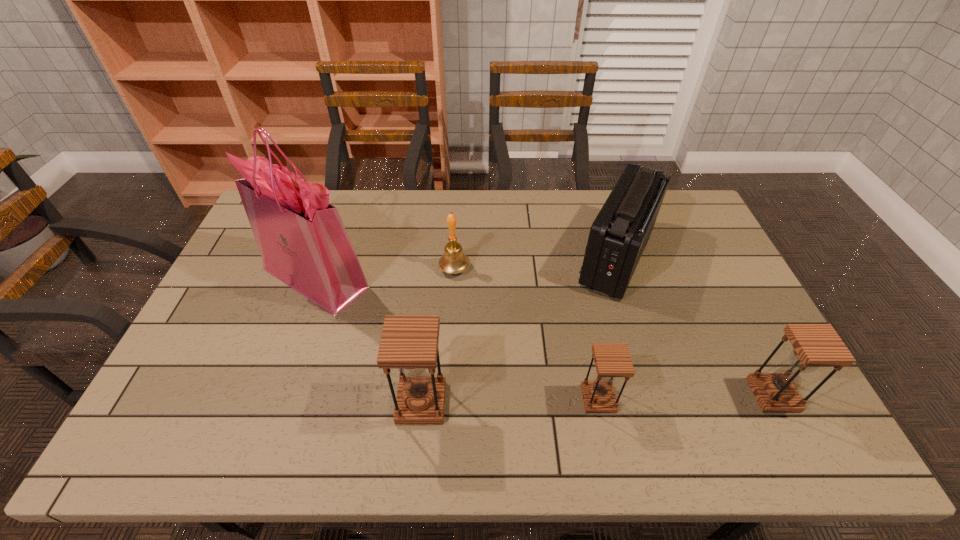
The image size is (960, 540). In order to click on vacant spot to place a hourglass on the left in this screenshot , I will do `click(242, 407)`.